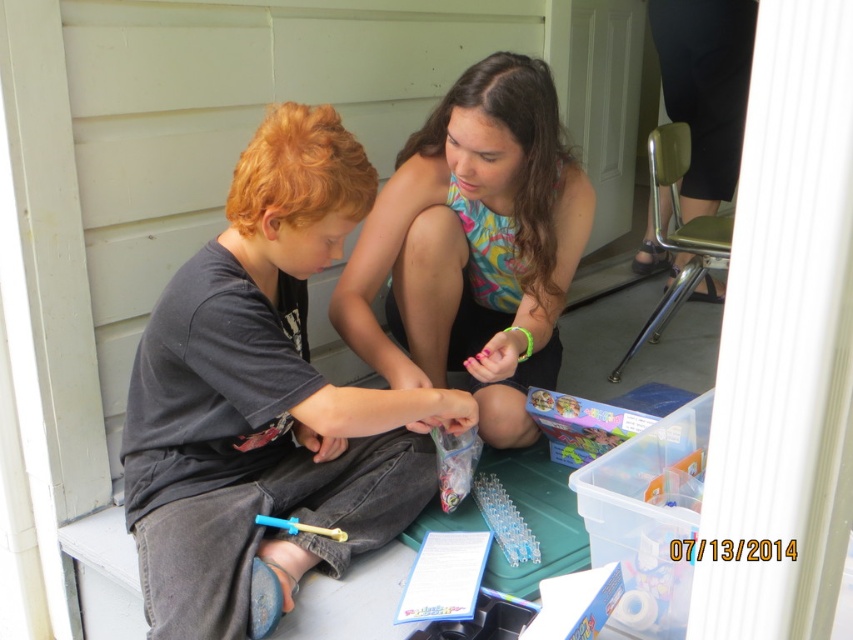
Question: Does dark gray t-shirt at left have a lesser width compared to multicolored fabric shirt at center?

Choices:
 (A) no
 (B) yes

Answer: (A)

Question: Which object appears closest to the camera in this image?

Choices:
 (A) multicolored fabric shirt at center
 (B) dark gray t-shirt at left

Answer: (B)

Question: Is dark gray t-shirt at left above multicolored fabric shirt at center?

Choices:
 (A) yes
 (B) no

Answer: (B)

Question: Which point is closer to the camera taking this photo?

Choices:
 (A) (260, 273)
 (B) (502, 236)

Answer: (A)

Question: Is dark gray t-shirt at left positioned behind multicolored fabric shirt at center?

Choices:
 (A) no
 (B) yes

Answer: (A)